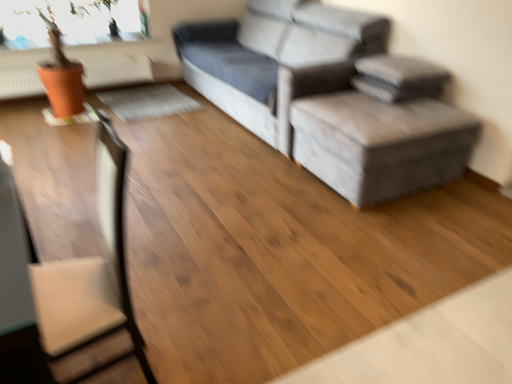
Question: From a real-world perspective, is gray fabric ottoman at center below gray fabric couch at upper right?

Choices:
 (A) yes
 (B) no

Answer: (A)

Question: Is gray fabric ottoman at center further to camera compared to gray fabric couch at upper right?

Choices:
 (A) yes
 (B) no

Answer: (B)

Question: From a real-world perspective, is gray fabric ottoman at center over gray fabric couch at upper right?

Choices:
 (A) no
 (B) yes

Answer: (A)

Question: Does gray fabric ottoman at center have a lesser height compared to gray fabric couch at upper right?

Choices:
 (A) no
 (B) yes

Answer: (B)

Question: Considering the relative positions of gray fabric ottoman at center and gray fabric couch at upper right in the image provided, is gray fabric ottoman at center to the left of gray fabric couch at upper right from the viewer's perspective?

Choices:
 (A) yes
 (B) no

Answer: (B)

Question: Based on their positions, is gray fabric ottoman at center located to the left or right of gray fabric couch at upper right?

Choices:
 (A) right
 (B) left

Answer: (A)

Question: Is gray fabric ottoman at center in front of or behind gray fabric couch at upper right in the image?

Choices:
 (A) front
 (B) behind

Answer: (A)

Question: Do you think gray fabric ottoman at center is within gray fabric couch at upper right, or outside of it?

Choices:
 (A) inside
 (B) outside

Answer: (B)

Question: From a real-world perspective, is gray fabric ottoman at center positioned above or below gray fabric couch at upper right?

Choices:
 (A) above
 (B) below

Answer: (B)

Question: From the image's perspective, is gray fabric ottoman at center located above or below brown leather swivel chair at left?

Choices:
 (A) below
 (B) above

Answer: (B)

Question: Considering the positions of gray fabric ottoman at center and brown leather swivel chair at left in the image, is gray fabric ottoman at center taller or shorter than brown leather swivel chair at left?

Choices:
 (A) tall
 (B) short

Answer: (B)

Question: Based on their sizes in the image, would you say gray fabric ottoman at center is bigger or smaller than brown leather swivel chair at left?

Choices:
 (A) big
 (B) small

Answer: (A)

Question: Considering the positions of gray fabric ottoman at center and brown leather swivel chair at left in the image, is gray fabric ottoman at center wider or thinner than brown leather swivel chair at left?

Choices:
 (A) thin
 (B) wide

Answer: (B)

Question: Is orange matte radiator at upper left spatially inside gray fabric ottoman at center, or outside of it?

Choices:
 (A) outside
 (B) inside

Answer: (A)

Question: Is orange matte radiator at upper left wider or thinner than gray fabric ottoman at center?

Choices:
 (A) thin
 (B) wide

Answer: (A)